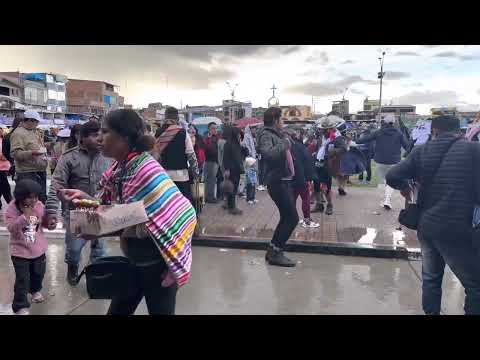
The width and height of the screenshot is (480, 360). Identify the location of wooden platform. (355, 230).